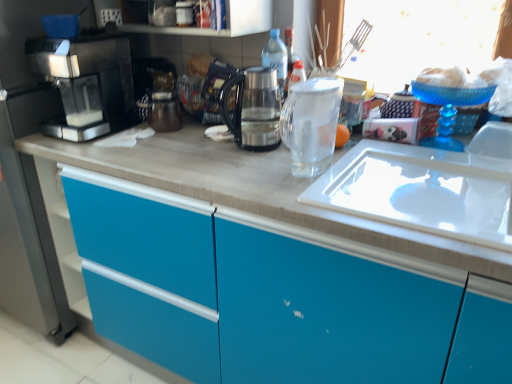
Question: Does sleek black coffee machine at left have a greater width compared to transparent glass at center?

Choices:
 (A) yes
 (B) no

Answer: (A)

Question: Does sleek black coffee machine at left appear on the left side of transparent glass at center?

Choices:
 (A) no
 (B) yes

Answer: (B)

Question: Is sleek black coffee machine at left facing away from transparent glass at center?

Choices:
 (A) yes
 (B) no

Answer: (B)

Question: From the image's perspective, is sleek black coffee machine at left over transparent glass at center?

Choices:
 (A) yes
 (B) no

Answer: (A)

Question: Does sleek black coffee machine at left contain transparent glass at center?

Choices:
 (A) no
 (B) yes

Answer: (A)

Question: From the image's perspective, is metallic black coffee maker at center above or below transparent glass coffee pot at center, placed as the first kitchen appliance when sorted from left to right?

Choices:
 (A) below
 (B) above

Answer: (B)

Question: In terms of width, does metallic black coffee maker at center look wider or thinner when compared to transparent glass coffee pot at center, placed as the 2th kitchen appliance when sorted from right to left?

Choices:
 (A) thin
 (B) wide

Answer: (A)

Question: Considering the positions of metallic black coffee maker at center and transparent glass coffee pot at center, placed as the first kitchen appliance when sorted from left to right, in the image, is metallic black coffee maker at center taller or shorter than transparent glass coffee pot at center, placed as the first kitchen appliance when sorted from left to right,?

Choices:
 (A) tall
 (B) short

Answer: (B)

Question: Considering the positions of point (190, 57) and point (266, 142), is point (190, 57) closer or farther from the camera than point (266, 142)?

Choices:
 (A) farther
 (B) closer

Answer: (A)

Question: Is clear glass pitcher at center, the 2th kitchen appliance in the left-to-right sequence, bigger or smaller than sleek black coffee machine at left?

Choices:
 (A) big
 (B) small

Answer: (B)

Question: Is clear glass pitcher at center, the 2th kitchen appliance in the left-to-right sequence, inside or outside of sleek black coffee machine at left?

Choices:
 (A) outside
 (B) inside

Answer: (A)

Question: Is point (288, 134) closer or farther from the camera than point (80, 49)?

Choices:
 (A) closer
 (B) farther

Answer: (A)

Question: Considering the positions of clear glass pitcher at center, the 2th kitchen appliance in the left-to-right sequence, and sleek black coffee machine at left in the image, is clear glass pitcher at center, the 2th kitchen appliance in the left-to-right sequence, taller or shorter than sleek black coffee machine at left?

Choices:
 (A) tall
 (B) short

Answer: (B)

Question: Based on their sizes in the image, would you say metallic black coffee maker at center is bigger or smaller than sleek black coffee machine at left?

Choices:
 (A) small
 (B) big

Answer: (A)

Question: Is metallic black coffee maker at center taller or shorter than sleek black coffee machine at left?

Choices:
 (A) tall
 (B) short

Answer: (B)